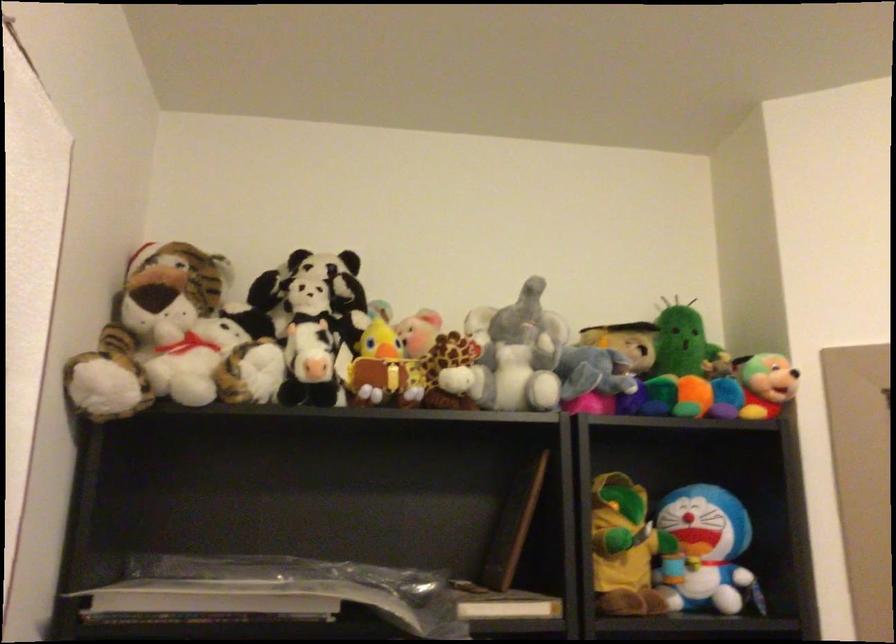
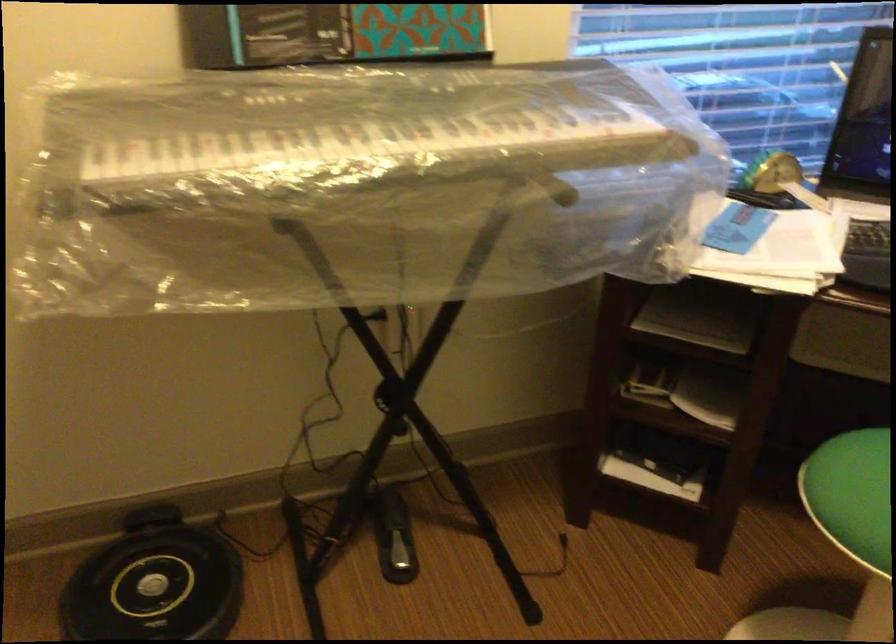
First-person continuous shooting, in which direction is the camera rotating?

The camera's rotation is toward right-down.